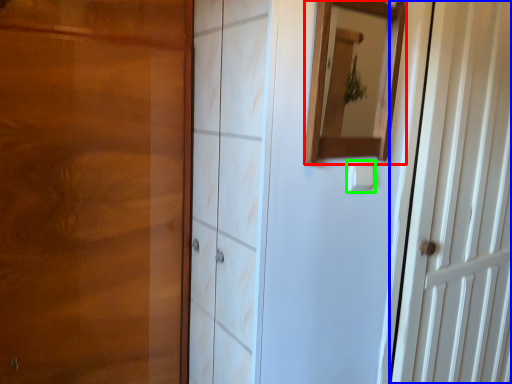
Question: Which object is the farthest from mirror (highlighted by a red box)? Choose among these: door (highlighted by a blue box) or light switch (highlighted by a green box).

Choices:
 (A) door
 (B) light switch

Answer: (A)